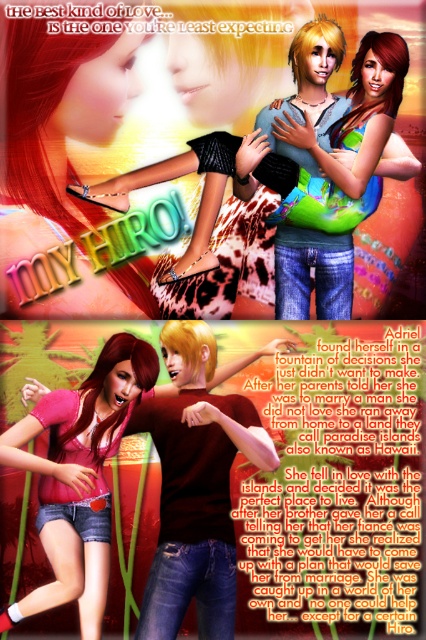
How much distance is there between shiny green bikini top at center and matte pink shirt at center?

They are 3.33 meters apart.

Who is positioned more to the left, shiny green bikini top at center or matte pink shirt at center?

Positioned to the left is matte pink shirt at center.

Image resolution: width=426 pixels, height=640 pixels. Identify the location of shiny green bikini top at center. (334, 180).

Does denim shorts at lower left have a greater width compared to matte pink shirt at center?

Indeed, denim shorts at lower left has a greater width compared to matte pink shirt at center.

Can you confirm if denim shorts at lower left is shorter than matte pink shirt at center?

No, denim shorts at lower left is not shorter than matte pink shirt at center.

Where is `denim shorts at lower left`? Image resolution: width=426 pixels, height=640 pixels. denim shorts at lower left is located at coordinates (78, 477).

I want to click on denim shorts at lower left, so click(x=78, y=477).

Based on the photo, measure the distance from denim shorts at lower left to shiny green bikini top at center.

denim shorts at lower left is 2.66 meters away from shiny green bikini top at center.

The height and width of the screenshot is (640, 426). Describe the element at coordinates (78, 477) in the screenshot. I see `denim shorts at lower left` at that location.

Identify the location of denim shorts at lower left. This screenshot has height=640, width=426. (78, 477).